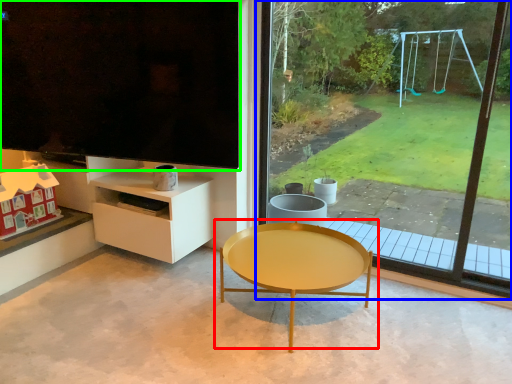
Question: Estimate the real-world distances between objects in this image. Which object is farther from coffee table (highlighted by a red box), window (highlighted by a blue box) or window screen (highlighted by a green box)?

Choices:
 (A) window
 (B) window screen

Answer: (A)